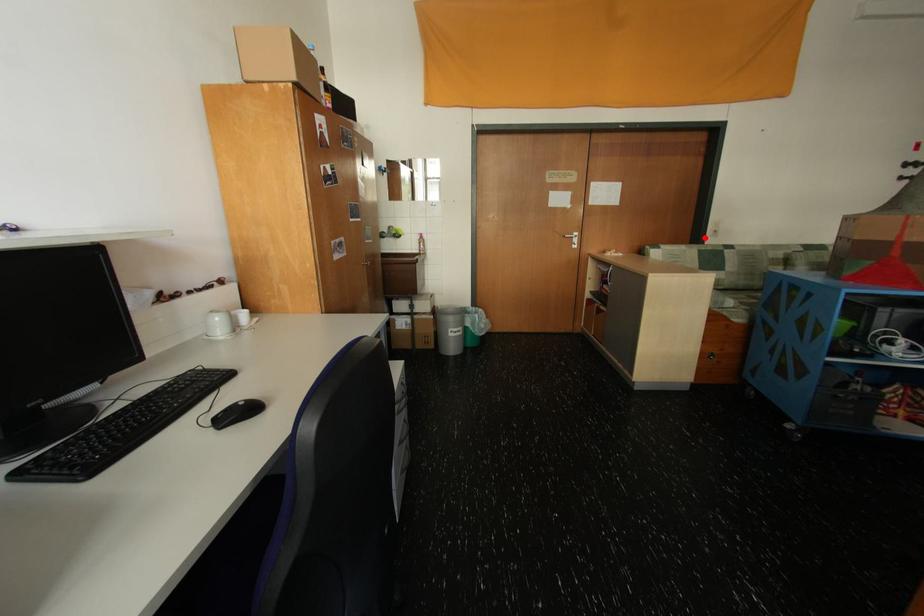
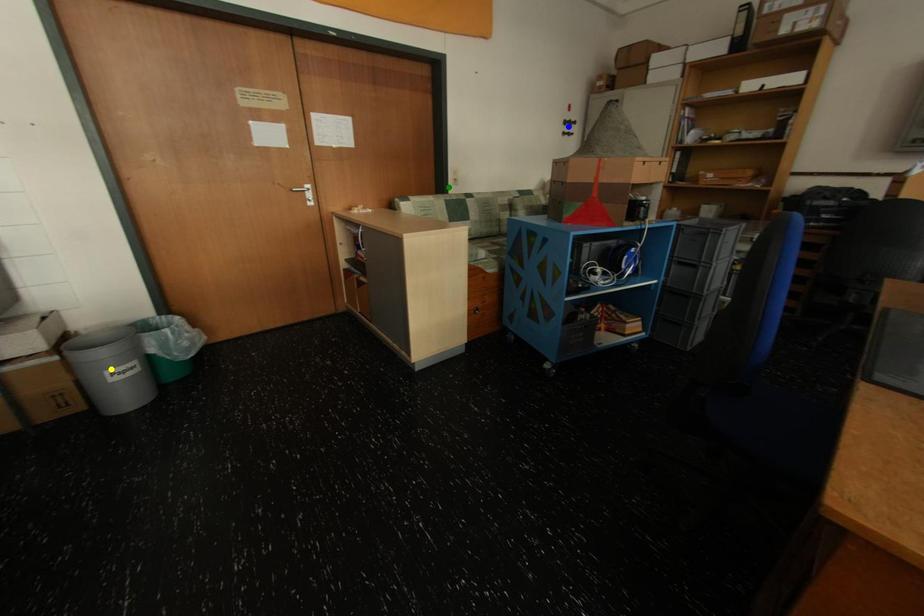
Question: I am providing you with two images of the same scene from different viewpoints. A red point is marked on the first image. You are given multiple points on the second image. Which spot in image 2 lines up with the point in image 1?

Choices:
 (A) green point
 (B) yellow point
 (C) blue point

Answer: (A)